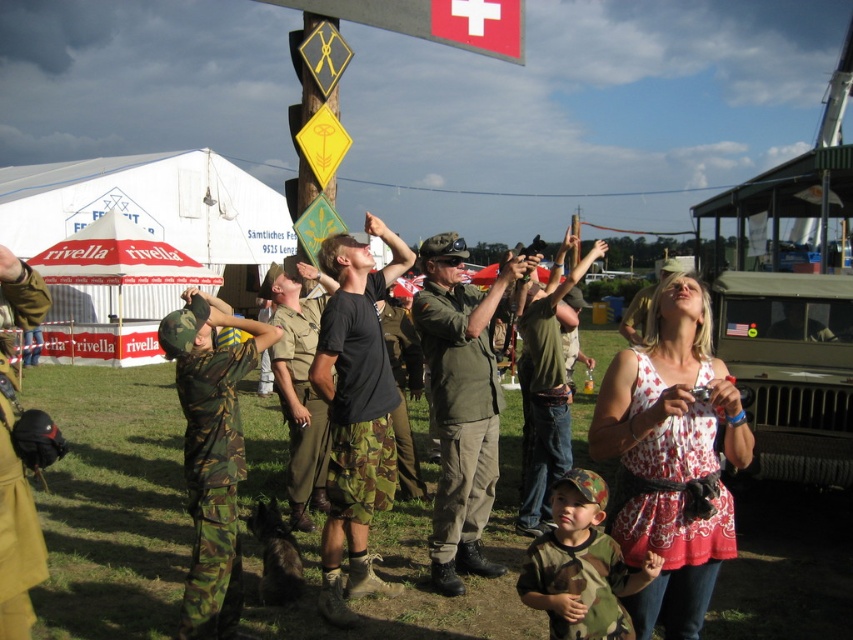
Question: Which point is closer to the camera?

Choices:
 (A) camouflage fabric uniform at center
 (B) white printed fabric dress at lower right

Answer: (B)

Question: Does black cotton t-shirt at center have a greater width compared to green uniform at center?

Choices:
 (A) no
 (B) yes

Answer: (B)

Question: Can you confirm if camo fabric uniform at center is positioned to the left of camo fabric shirt at lower center?

Choices:
 (A) yes
 (B) no

Answer: (A)

Question: Which point is farther to the camera?

Choices:
 (A) (648, 435)
 (B) (0, 529)
 (C) (346, 312)

Answer: (C)

Question: Is camouflage fabric helmet at left to the right of green camouflage pants at center from the viewer's perspective?

Choices:
 (A) yes
 (B) no

Answer: (B)

Question: Which of the following is the farthest from the observer?

Choices:
 (A) camouflage fabric uniform at center
 (B) camouflage fabric helmet at left
 (C) camouflage fabric pants at center
 (D) green uniform at center

Answer: (A)